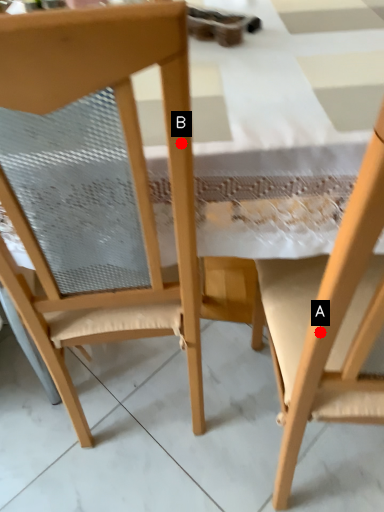
Question: Two points are circled on the image, labeled by A and B beside each circle. Which point is closer to the camera?

Choices:
 (A) A is closer
 (B) B is closer

Answer: (A)